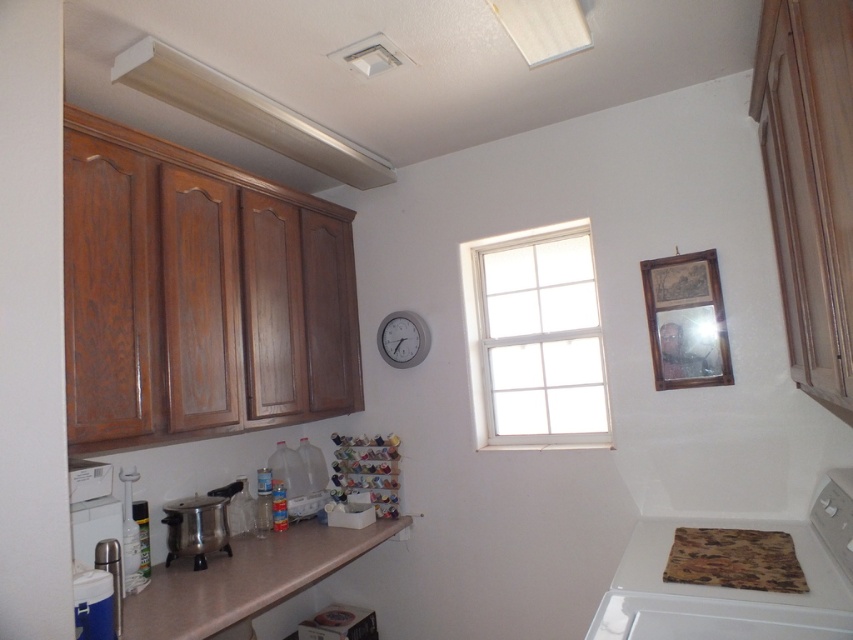
You are a chef trying to hang a decorative kitchen towel on the wall between the white glass window at center and the white glossy exhaust hood at upper center. Given their positions and sizes, which object will require you to step closer to reach its adjacent wall space?

The white glass window at center has a lesser width compared to the white glossy exhaust hood at upper center, so you will need to step closer to reach the wall space adjacent to the white glass window at center because it is narrower and occupies less space between the two objects.

You are a kitchen designer planning to install a new appliance. You have two items in the kitchen scene to consider, the white glossy exhaust hood at upper center and the white plastic clock at upper center. Which of these two items has a greater width?

The white glossy exhaust hood at upper center has a greater width than the white plastic clock at upper center.

You are a chef who wants to adjust the temperature using the white glossy exhaust hood at upper center. However, you notice a white plastic clock at upper center above the stove. Which object is closer to you when you are standing in front of them?

The white glossy exhaust hood at upper center is in front of the white plastic clock at upper center, so the exhaust hood is closer to you.